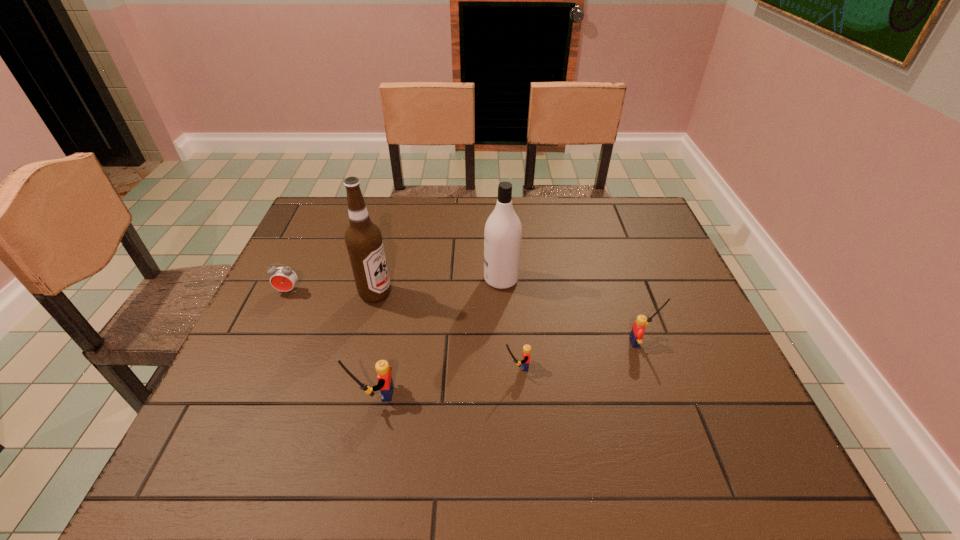
Where is `free region located 0.200m on the front-facing side of the fourth shortest object`? The height and width of the screenshot is (540, 960). free region located 0.200m on the front-facing side of the fourth shortest object is located at coordinates (261, 394).

This screenshot has height=540, width=960. Identify the location of free location located 0.070m on the front-facing side of the fourth shortest object. pos(323,394).

Image resolution: width=960 pixels, height=540 pixels. Find the location of `vacant space situated 0.340m on the front-facing side of the second Lego from left to right`. vacant space situated 0.340m on the front-facing side of the second Lego from left to right is located at coordinates (354, 367).

Locate an element on the screen. Image resolution: width=960 pixels, height=540 pixels. free space located 0.380m on the front-facing side of the second Lego from left to right is located at coordinates (336, 367).

This screenshot has height=540, width=960. I want to click on free location located 0.280m on the front-facing side of the second Lego from left to right, so click(x=380, y=367).

The height and width of the screenshot is (540, 960). In order to click on vacant area located 0.140m on the front-facing side of the second shortest Lego in this screenshot , I will do `click(718, 342)`.

Image resolution: width=960 pixels, height=540 pixels. In order to click on vacant space located 0.310m on the label of the alcohol in this screenshot , I will do `click(509, 294)`.

In order to click on free spot located 0.230m on the front-facing side of the shampoo in this screenshot , I will do `click(400, 279)`.

Where is `vacant space located on the front-facing side of the shampoo`? vacant space located on the front-facing side of the shampoo is located at coordinates (415, 279).

This screenshot has height=540, width=960. Find the location of `vacant region located 0.280m on the front-facing side of the shampoo`. vacant region located 0.280m on the front-facing side of the shampoo is located at coordinates (382, 279).